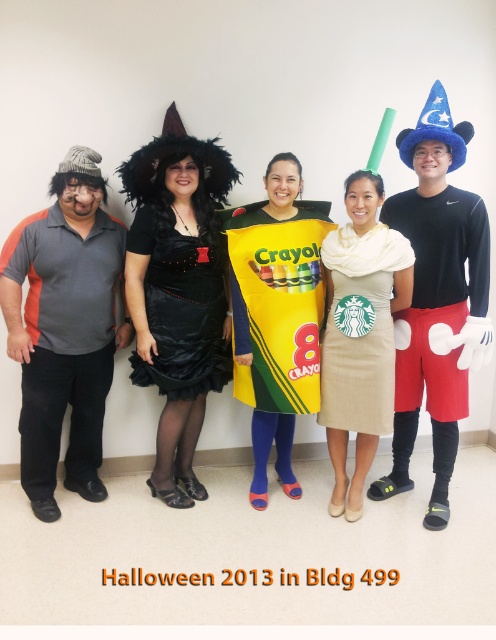
Is velvet black dress at center below beige textured dress at center?

No, velvet black dress at center is not below beige textured dress at center.

Between velvet black dress at center and beige textured dress at center, which one appears on the left side from the viewer's perspective?

From the viewer's perspective, velvet black dress at center appears more on the left side.

At what (x,y) coordinates should I click in order to perform the action: click on velvet black dress at center. Please return your answer as a coordinate pair (x, y). Looking at the image, I should click on (178, 291).

Measure the distance between blue felt hat at upper right and yellow matte crayon at center.

The distance of blue felt hat at upper right from yellow matte crayon at center is 76.66 centimeters.

Describe the element at coordinates (436, 300) in the screenshot. I see `blue felt hat at upper right` at that location.

Where is `blue felt hat at upper right`? The width and height of the screenshot is (496, 640). blue felt hat at upper right is located at coordinates (436, 300).

Does yellow fabric crayon at center appear over yellow matte crayon at center?

No, yellow fabric crayon at center is not above yellow matte crayon at center.

Consider the image. Does yellow fabric crayon at center appear on the left side of yellow matte crayon at center?

Yes, yellow fabric crayon at center is to the left of yellow matte crayon at center.

Which is in front, point (310, 216) or point (137, 452)?

Point (310, 216) is more forward.

Where is `yellow fabric crayon at center`? The image size is (496, 640). yellow fabric crayon at center is located at coordinates (277, 314).